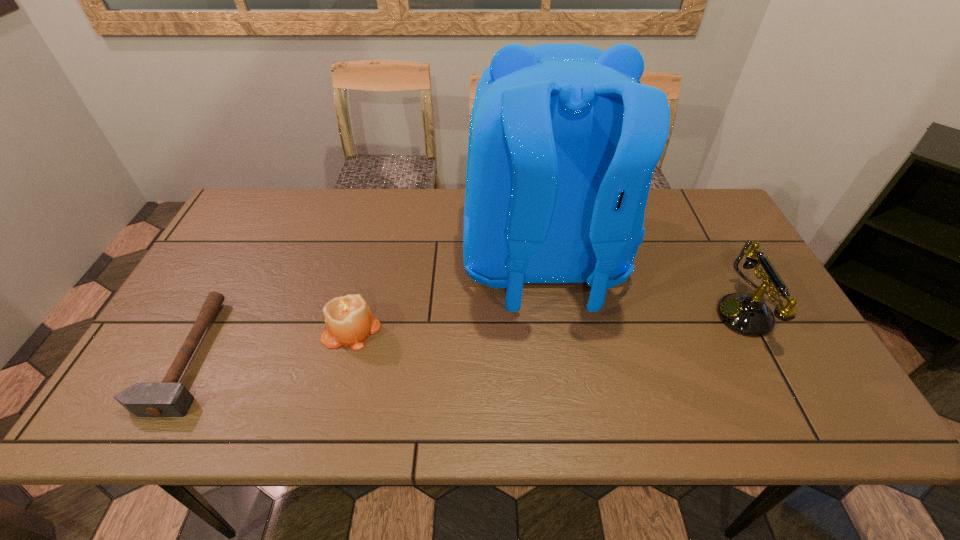
Identify the location of free space at the near edge. The width and height of the screenshot is (960, 540). (522, 426).

This screenshot has height=540, width=960. In the image, there is a desktop. What are the coordinates of `free region at the left edge` in the screenshot? It's located at (195, 353).

The image size is (960, 540). In the image, there is a desktop. What are the coordinates of `vacant space at the right edge` in the screenshot? It's located at (740, 268).

In the image, there is a desktop. At what (x,y) coordinates should I click in order to perform the action: click on free space at the far left corner. Please return your answer as a coordinate pair (x, y). Image resolution: width=960 pixels, height=540 pixels. Looking at the image, I should click on (x=284, y=197).

You are a GUI agent. You are given a task and a screenshot of the screen. Output one action in this format:
    pyautogui.click(x=<x>, y=<y>)
    Task: Click on the vacant area at the far right corner of the desktop
    The width and height of the screenshot is (960, 540).
    Given the screenshot: What is the action you would take?
    pyautogui.click(x=714, y=212)

The height and width of the screenshot is (540, 960). I want to click on free spot between the tallest object and the third shortest object, so click(x=646, y=289).

Image resolution: width=960 pixels, height=540 pixels. What are the coordinates of `empty space that is in between the third object from left to right and the second object from left to right` in the screenshot? It's located at (447, 297).

At what (x,y) coordinates should I click in order to perform the action: click on free space between the hammer and the third shortest object. Please return your answer as a coordinate pair (x, y). This screenshot has height=540, width=960. Looking at the image, I should click on (469, 335).

Find the location of a particular element. free space between the shortest object and the telephone is located at coordinates (469, 335).

Find the location of `free spot between the candle and the leftmost object`. free spot between the candle and the leftmost object is located at coordinates (270, 342).